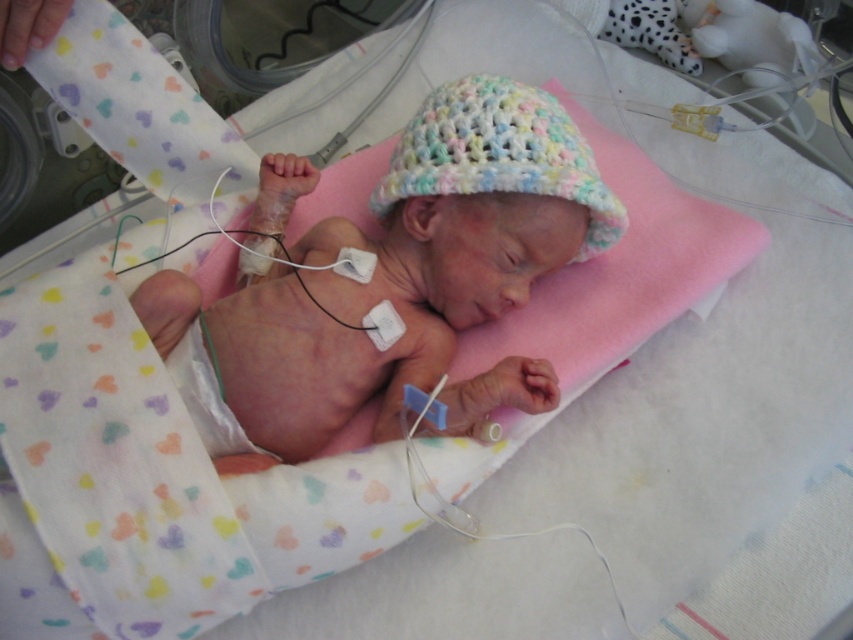
You are a nurse in a neonatal unit. You need to choose between the pastel crocheted hat at center and the pastel crochet hat at center for a newborn. Which hat should you pick if you need the larger one?

The pastel crocheted hat at center is larger in size than the pastel crochet hat at center, so you should choose the pastel crocheted hat at center.

Based on the photo, where is the pastel crocheted hat at center located in the image?

The pastel crocheted hat at center is located at point coordinates of (399, 268).